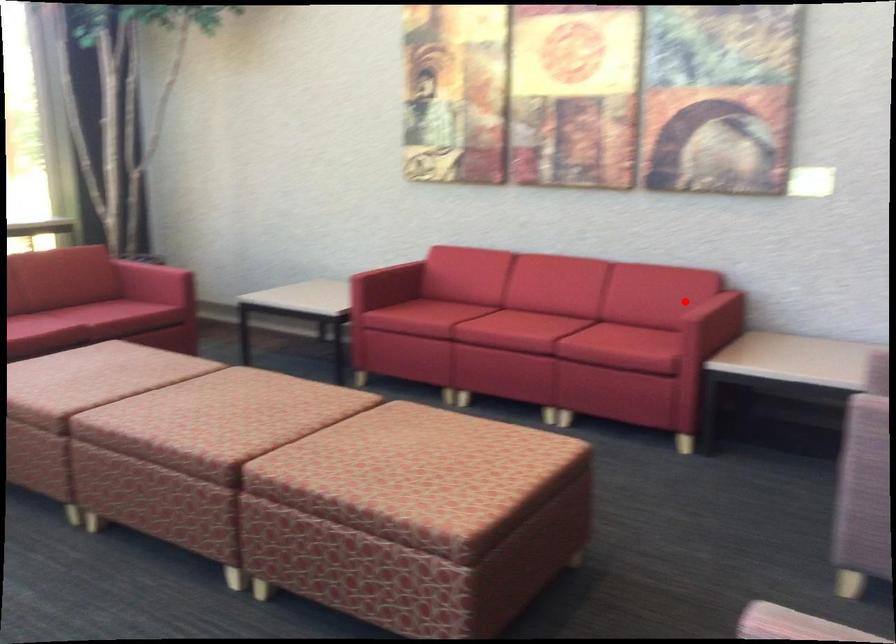
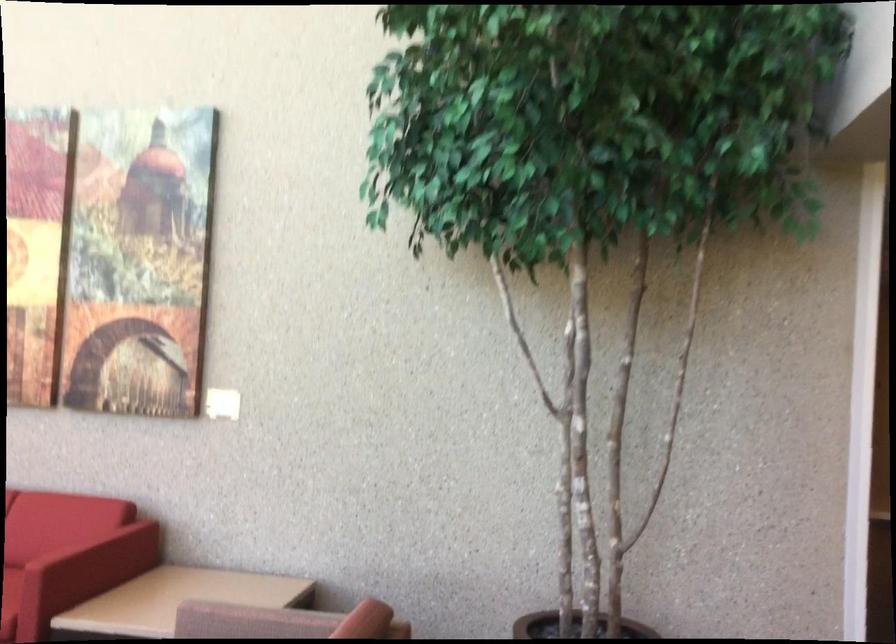
Where in the second image is the point corresponding to the highlighted location from the first image?

(80, 540)